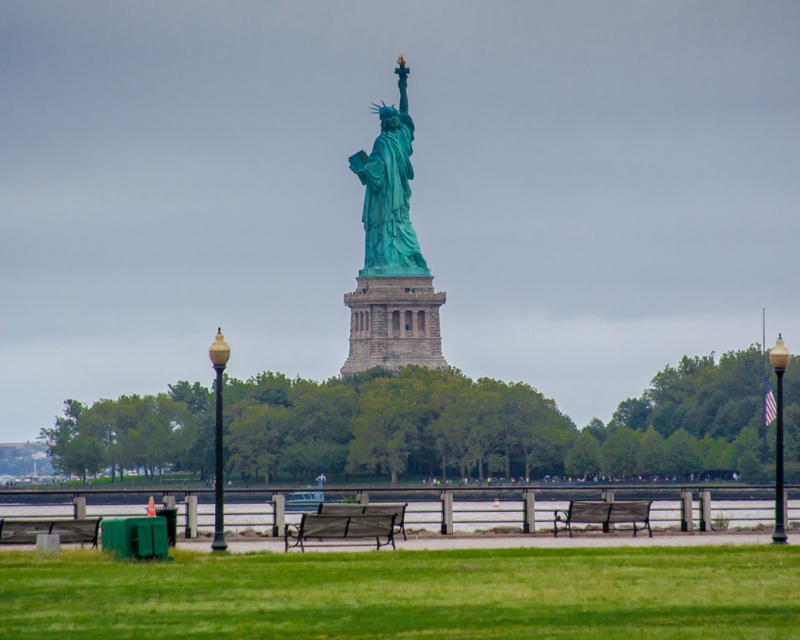
Question: Can you confirm if metallic green bench at center is thinner than wooden bench at center?

Choices:
 (A) no
 (B) yes

Answer: (A)

Question: Which point is farther to the camera?

Choices:
 (A) wooden bench at center
 (B) metallic green bench at center
 (C) wooden park bench at center
 (D) gold polished lamp post at center

Answer: (C)

Question: Is green patina statue at center to the left of metallic green bench at center from the viewer's perspective?

Choices:
 (A) yes
 (B) no

Answer: (B)

Question: Which point is farther to the camera?

Choices:
 (A) metallic green bench at center
 (B) wooden bench at center
 (C) gold polished lamp post at center
 (D) clear water at lower center

Answer: (D)

Question: Can you confirm if metallic green bench at center is smaller than wooden park bench at center?

Choices:
 (A) no
 (B) yes

Answer: (B)

Question: Which of these objects is positioned closest to the gold polished lamp post at center?

Choices:
 (A) green patina statue at center
 (B) wooden park bench at center

Answer: (B)